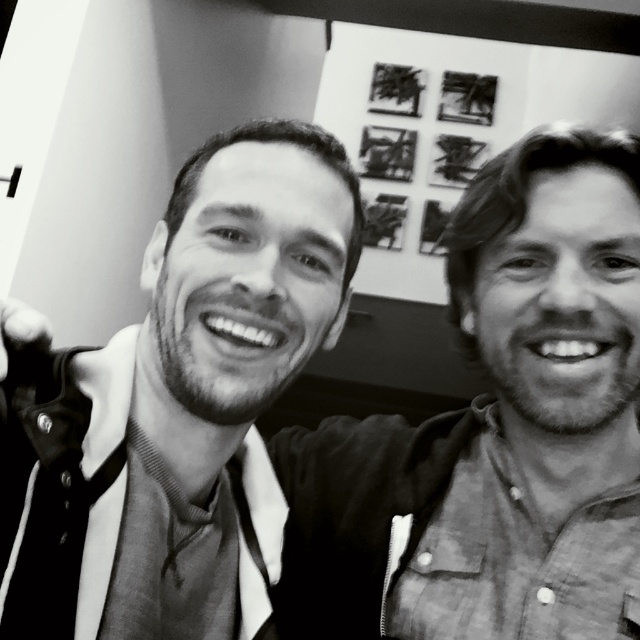
Is smooth black shirt at center smaller than smooth black shirt at left?

No.

Is smooth black shirt at center to the left of smooth black shirt at left from the viewer's perspective?

No, smooth black shirt at center is not to the left of smooth black shirt at left.

Between point (627, 480) and point (273, 582), which one is positioned behind?

Point (627, 480)

Find the location of a particular element. smooth black shirt at center is located at coordinates (497, 429).

Who is more forward, (426, 525) or (136, 605)?

Positioned in front is point (136, 605).

Who is taller, smooth black shirt at center or matte black tie at center?

smooth black shirt at center

Between point (564, 284) and point (163, 461), which one is positioned in front?

Point (564, 284) is more forward.

I want to click on smooth black shirt at center, so click(x=497, y=429).

Who is more forward, (186, 324) or (160, 480)?

Positioned in front is point (186, 324).

Measure the distance between point (22, 625) and camera.

51.56 centimeters

Identify the location of smooth black shirt at left. 172,397.